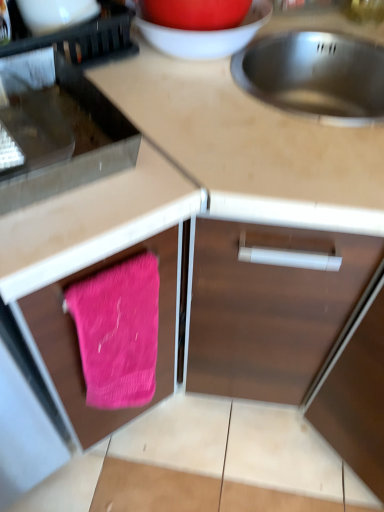
You are a GUI agent. You are given a task and a screenshot of the screen. Output one action in this format:
    pyautogui.click(x=<x>, y=<y>)
    Task: Click on the empty space that is ontop of pink fabric at lower left
    The width and height of the screenshot is (384, 512).
    Given the screenshot: What is the action you would take?
    pyautogui.click(x=60, y=133)